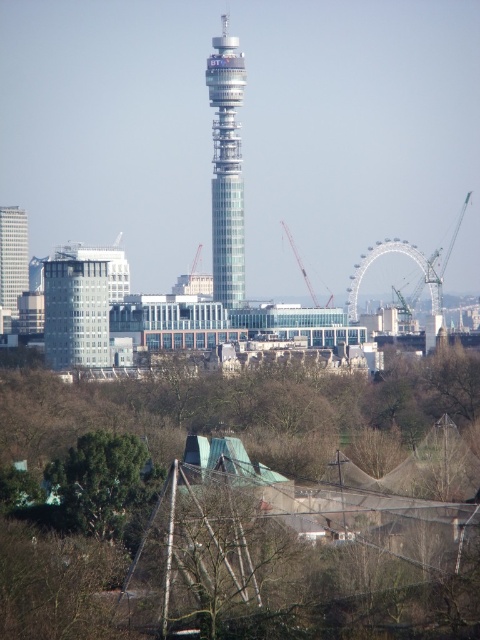
How distant is green leafy tree at lower left from metallic gray crane at right?

A distance of 115.69 meters exists between green leafy tree at lower left and metallic gray crane at right.

Does green leafy tree at lower left lie behind metallic gray crane at right?

No.

Find the location of a particular element. The width and height of the screenshot is (480, 640). green leafy tree at lower left is located at coordinates (105, 486).

Find the location of `green leafy tree at lower left`. green leafy tree at lower left is located at coordinates (105, 486).

Which is below, glassy gray building at center or metallic gray crane at center?

glassy gray building at center is lower down.

Is glassy gray building at center smaller than metallic gray crane at center?

No, glassy gray building at center is not smaller than metallic gray crane at center.

Who is more distant from viewer, (78, 314) or (314, 296)?

Positioned behind is point (78, 314).

Locate an element on the screen. glassy gray building at center is located at coordinates (75, 314).

Does glassy metallic tower at center come in front of glassy white skyscraper at left?

Yes, it is.

Where is `glassy metallic tower at center`? The height and width of the screenshot is (640, 480). glassy metallic tower at center is located at coordinates click(227, 168).